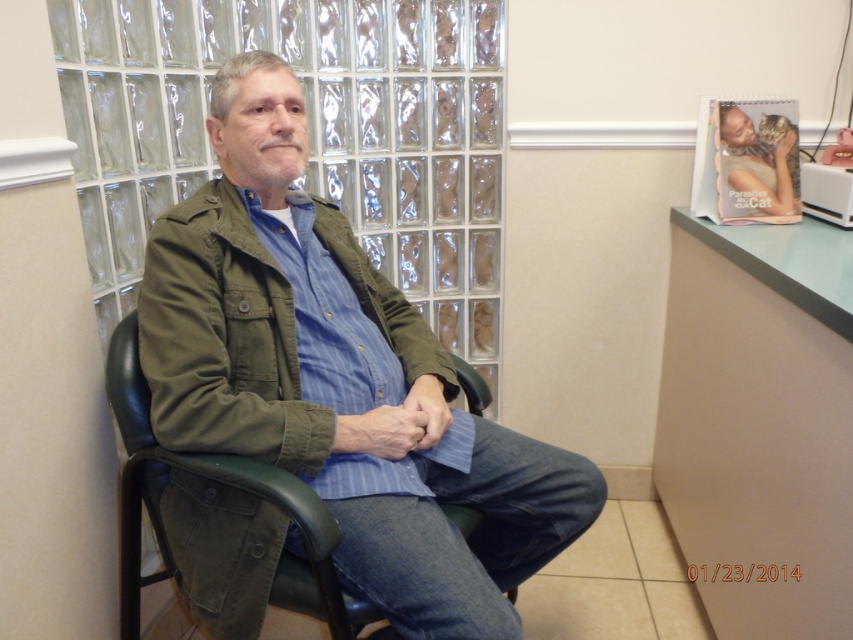
Question: Is matte green jacket at center smaller than green leather chair at center?

Choices:
 (A) no
 (B) yes

Answer: (A)

Question: Is olive green fabric jacket at center closer to the viewer compared to green leather chair at center?

Choices:
 (A) yes
 (B) no

Answer: (B)

Question: Which object appears farthest from the camera in this image?

Choices:
 (A) olive green fabric jacket at center
 (B) green leather chair at center

Answer: (A)

Question: Among these objects, which one is farthest from the camera?

Choices:
 (A) matte green jacket at center
 (B) olive green fabric jacket at center
 (C) green leather chair at center

Answer: (B)

Question: Which of the following is the closest to the observer?

Choices:
 (A) (378, 412)
 (B) (271, 449)

Answer: (B)

Question: Can you confirm if matte green jacket at center is bigger than olive green fabric jacket at center?

Choices:
 (A) yes
 (B) no

Answer: (A)